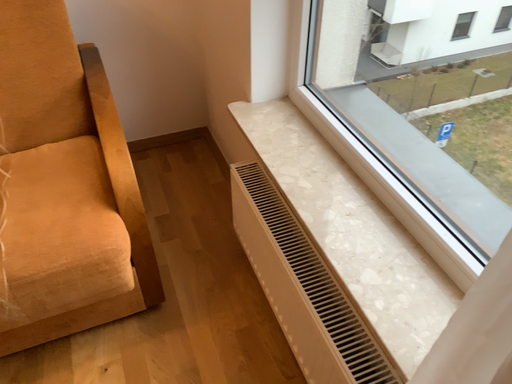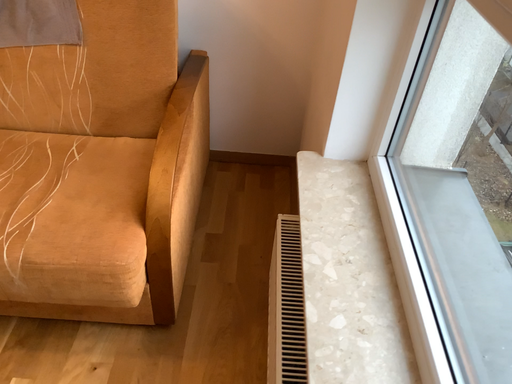
Question: How did the camera likely rotate when shooting the video?

Choices:
 (A) rotated left
 (B) rotated right

Answer: (A)